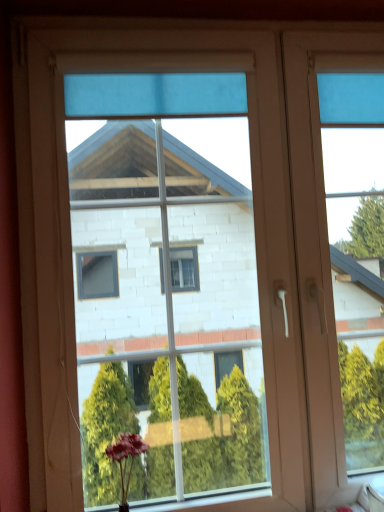
At what (x,y) coordinates should I click in order to perform the action: click on matte pink flower at lower center. Please return your answer as a coordinate pair (x, y). Looking at the image, I should click on (125, 460).

Describe the element at coordinates (125, 460) in the screenshot. I see `matte pink flower at lower center` at that location.

Locate an element on the screen. The image size is (384, 512). matte pink flower at lower center is located at coordinates (125, 460).